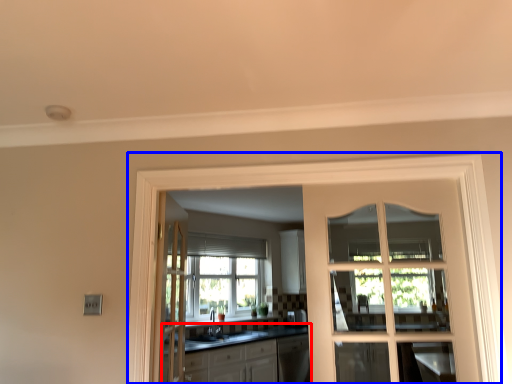
Question: Which of the following is the closest to the observer, cabinetry (highlighted by a red box) or window frame (highlighted by a blue box)?

Choices:
 (A) cabinetry
 (B) window frame

Answer: (B)